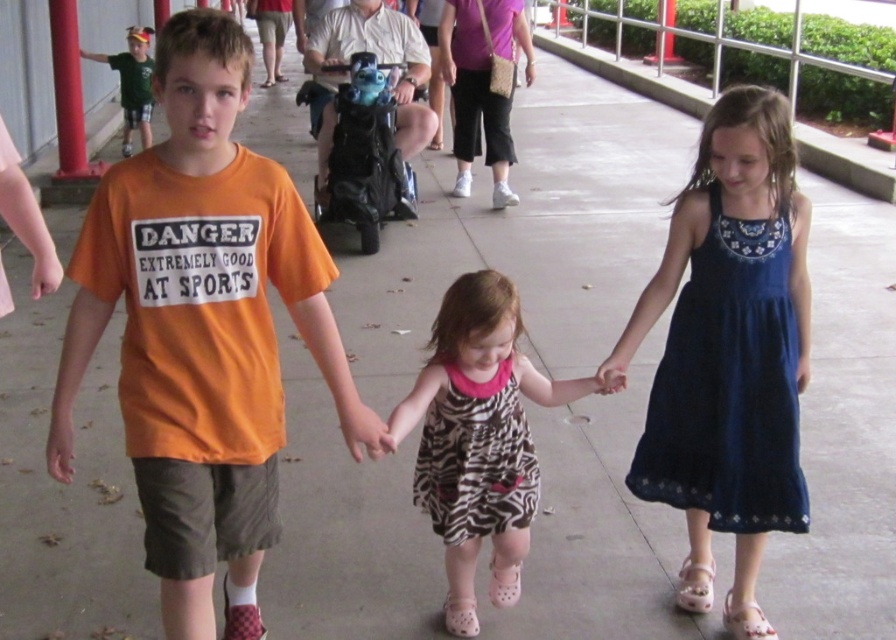
You are a photographer trying to capture a group photo of the dark blue cotton dress at right and the zebra print dress at center. Since you want to ensure both are in frame, which direction should you position yourself relative to the children?

You should position yourself to the left side of the children because the dark blue cotton dress at right is positioned on the right side of the zebra print dress at center, so placing yourself to the left would allow both dresses to be captured in the frame.

You are standing at the center of the pathway in the scene. A red painted metal pole is located at point (67, 92). Which direction should you walk to reach the red painted metal pole at upper left?

The red painted metal pole at upper left is located at the upper left direction from your current position at the center of the pathway.

You are a painter standing on a ladder, and you want to paint the red painted metal pole at upper left and the green jersey at upper left. If your ladder is 6 feet tall, can you reach both objects while standing on the ladder?

The red painted metal pole at upper left and green jersey at upper left are 6.51 feet apart from each other. Since the ladder is only 6 feet tall, you cannot reach both objects as the distance between them exceeds the ladder height.